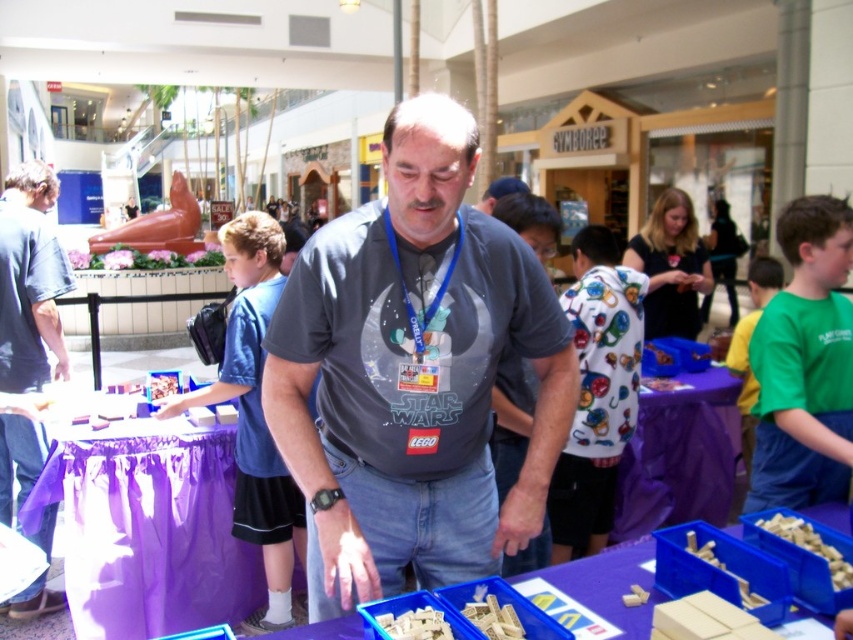
Who is taller, wooden blocks at lower center or matte plastic toy at center?

With more height is matte plastic toy at center.

Is wooden blocks at lower center below matte plastic toy at center?

Yes, wooden blocks at lower center is below matte plastic toy at center.

Which is in front, point (426, 616) or point (167, 387)?

Positioned in front is point (426, 616).

The image size is (853, 640). What are the coordinates of `wooden blocks at lower center` in the screenshot? It's located at (415, 625).

The width and height of the screenshot is (853, 640). In order to click on wooden blocks at center in this screenshot , I will do `click(492, 616)`.

Identify the location of wooden blocks at center. The image size is (853, 640). (492, 616).

Does blue plastic bins at center come behind wooden blocks at lower center?

Yes, blue plastic bins at center is further from the viewer.

Which is in front, point (598, 589) or point (432, 609)?

Point (432, 609) is in front.

Measure the distance between blue plastic bins at center and camera.

They are 1.66 meters apart.

The width and height of the screenshot is (853, 640). I want to click on blue plastic bins at center, so click(x=610, y=586).